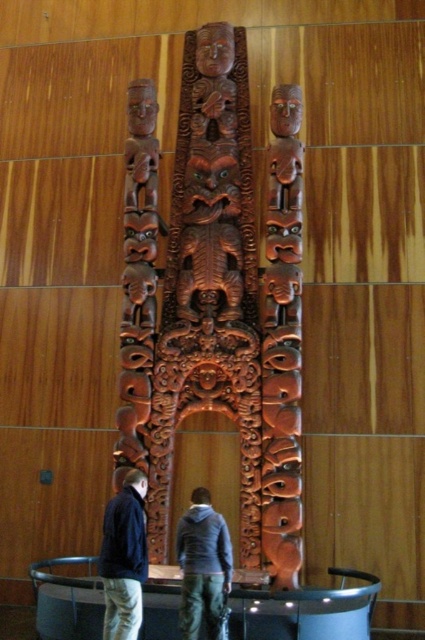
You are standing in front of the carved wooden structure and see the dark gray hoodie at center and the dark blue jacket at lower left. Which clothing item is closer to the central figure of the carving?

The dark gray hoodie at center is positioned under the dark blue jacket at lower left, meaning it is closer to the central figure of the carving.

You are an art conservator examining the carved wooden structure. You notice two points on the carving labeled as point [116,522] and point [187,570]. Which point is closer to your current position as you examine the carving?

Point [116,522] is further to the camera than point [187,570], so point [187,570] is closer to your current position.

You are standing in front of the carved wooden structure and notice two garments displayed nearby. The dark gray hoodie at center and the dark blue jacket at lower left. Which garment is closer to you?

The dark gray hoodie at center is closer to you since it is in front of the dark blue jacket at lower left.